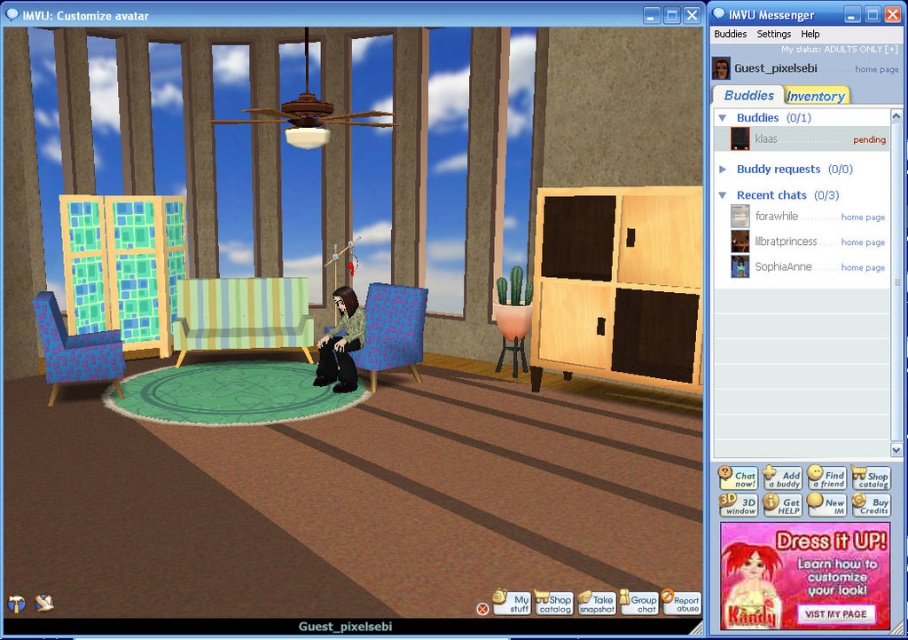
You are an avatar in the IMVU room and want to move from the wooden cabinet at right to the green striped fabric armchair at center. Can you walk directly between them without any obstacles?

The wooden cabinet at right is positioned over the green striped fabric armchair at center, so there is no space between them for the avatar to walk directly. The avatar would need to move around the cabinet or the chair to reach the other object.

You are an interior designer planning to place a new lamp between the matte blue fabric armchair at center and the blue pixelated armchair at left. Considering their heights, which armchair should the lamp be placed closer to for visual balance?

The matte blue fabric armchair at center is much taller than the blue pixelated armchair at left, so the lamp should be placed closer to the shorter blue pixelated armchair at left to achieve visual balance.